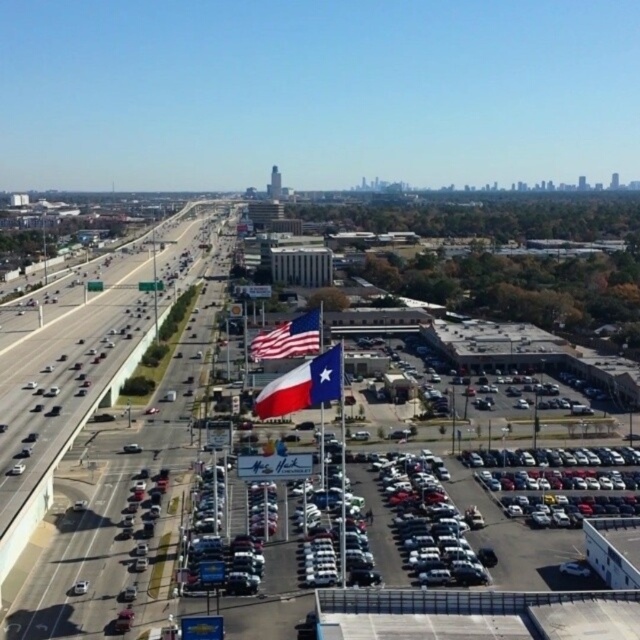
You are a delivery driver who needs to turn left onto the highway. You see the asphalt road at center and the texas flag at center in the parking lot. Which object is positioned to the left of the other?

The asphalt road at center is to the left of the texas flag at center.